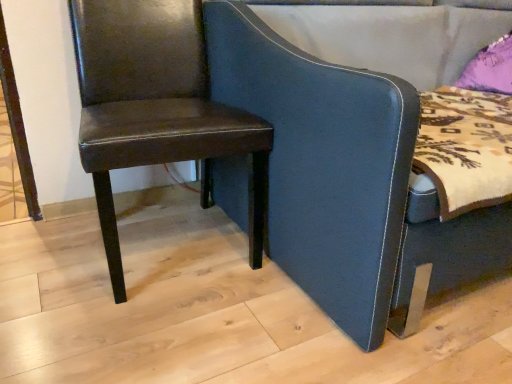
The height and width of the screenshot is (384, 512). What are the coordinates of `vacant area that lies in front of matte brown leather chair at left, placed as the 1th chair when sorted from left to right` in the screenshot? It's located at (151, 327).